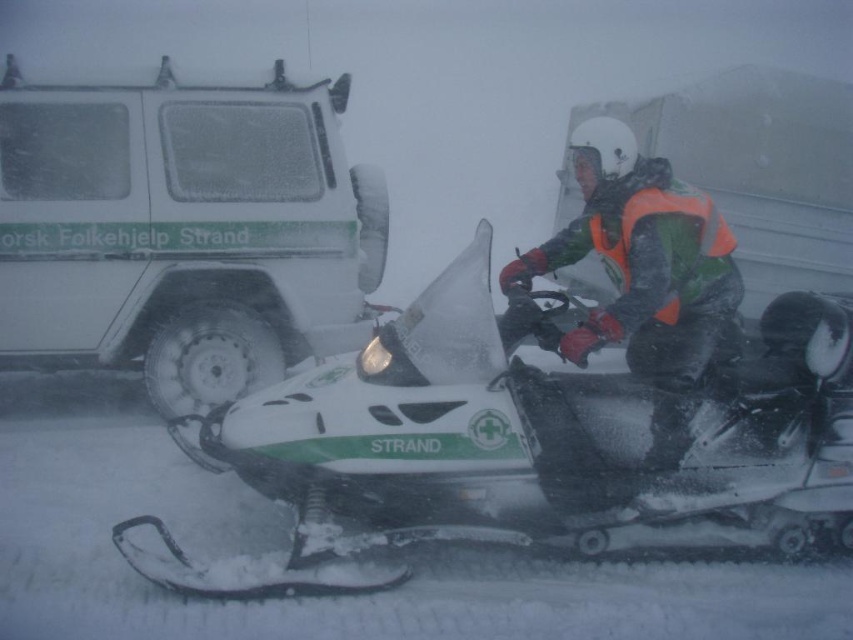
You are standing at the origin point of the image. Which of the two points, point (366, 468) or point (33, 128), is closer to you?

Point (366, 468) is closer to the viewer than point (33, 128).

You are a rescue worker needing to quickly assess the situation. From your vantage point, which object is nearer to you between the white matte snowmobile at center and the reflective orange vest at center?

The white matte snowmobile at center is closer to the viewer than the reflective orange vest at center.

You are a rescue worker who needs to transport equipment. The white matte snowmobile at center and the white matte van at upper left are available. Which vehicle can carry more equipment based on their size?

The white matte snowmobile at center is bigger than the white matte van at upper left, so it can carry more equipment.